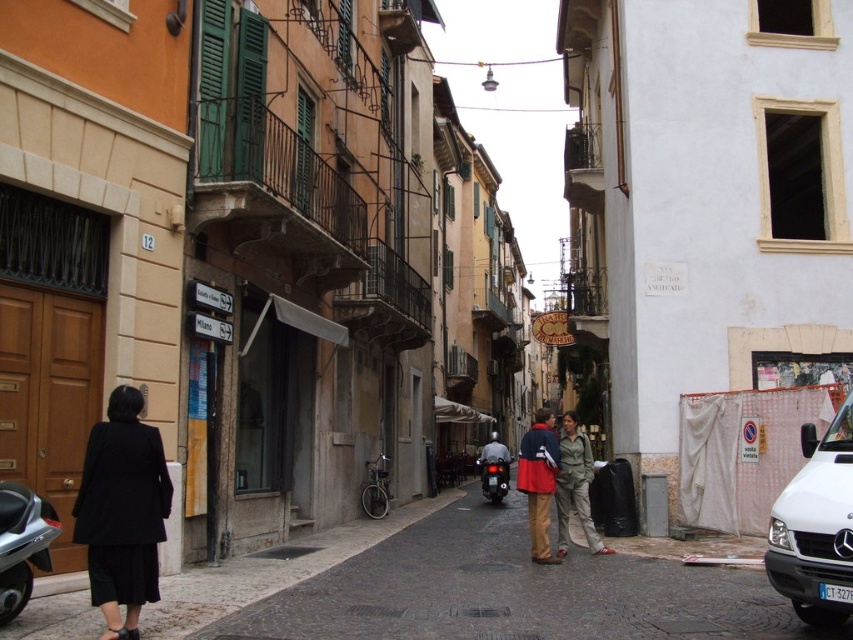
Is red fabric coat at center to the right of khaki cotton pants at center from the viewer's perspective?

No, red fabric coat at center is not to the right of khaki cotton pants at center.

Which is in front, point (552, 458) or point (561, 516)?

Point (552, 458) is in front.

At what (x,y) coordinates should I click in order to perform the action: click on red fabric coat at center. Please return your answer as a coordinate pair (x, y). Image resolution: width=853 pixels, height=640 pixels. Looking at the image, I should click on (538, 481).

Where is `red fabric coat at center`? red fabric coat at center is located at coordinates (538, 481).

In the scene shown: Does matte black scooter at center have a lesser width compared to white matte van at lower right?

Incorrect, matte black scooter at center's width is not less than white matte van at lower right's.

In the scene shown: Between matte black scooter at center and white matte van at lower right, which one is positioned lower?

matte black scooter at center

You are a GUI agent. You are given a task and a screenshot of the screen. Output one action in this format:
    pyautogui.click(x=<x>, y=<y>)
    Task: Click on the matte black scooter at center
    This screenshot has height=640, width=853.
    Given the screenshot: What is the action you would take?
    pyautogui.click(x=514, y=593)

The width and height of the screenshot is (853, 640). I want to click on matte black scooter at center, so click(514, 593).

Does black wool coat at lower left appear under khaki cotton pants at center?

No.

Is point (91, 576) closer to camera compared to point (585, 536)?

Yes, point (91, 576) is in front of point (585, 536).

Is point (109, 500) farther from camera compared to point (573, 451)?

No, it is not.

Locate an element on the screen. The image size is (853, 640). black wool coat at lower left is located at coordinates (122, 512).